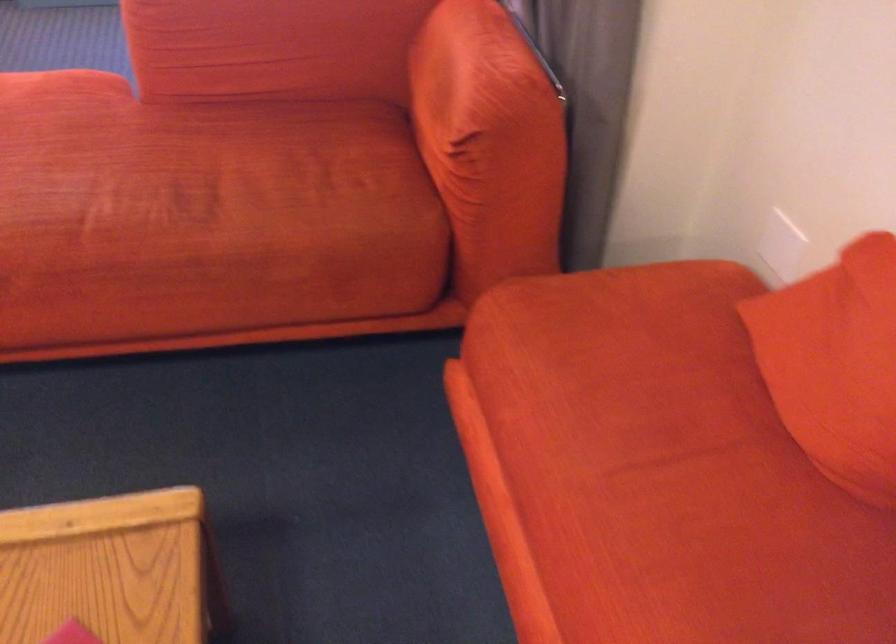
The image size is (896, 644). Find the location of `red sofa armrest`. red sofa armrest is located at coordinates (530, 53).